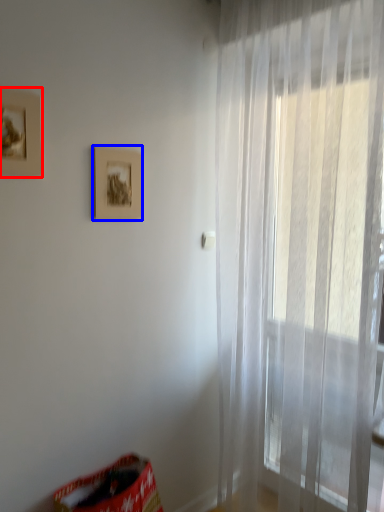
Question: Which point is closer to the camera, picture frame (highlighted by a red box) or picture frame (highlighted by a blue box)?

Choices:
 (A) picture frame
 (B) picture frame

Answer: (A)